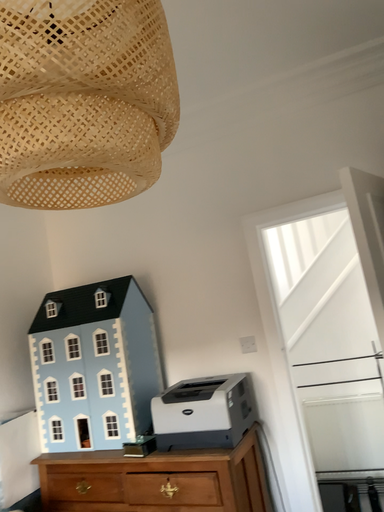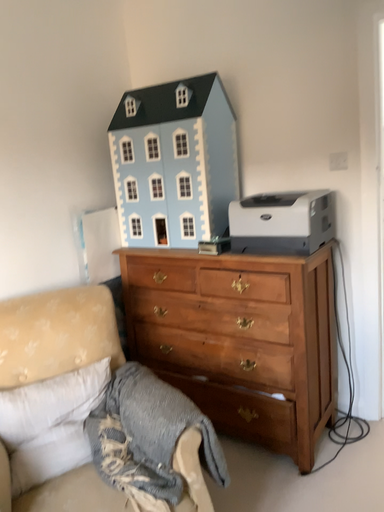
Question: How did the camera likely rotate when shooting the video?

Choices:
 (A) rotated downward
 (B) rotated upward

Answer: (A)